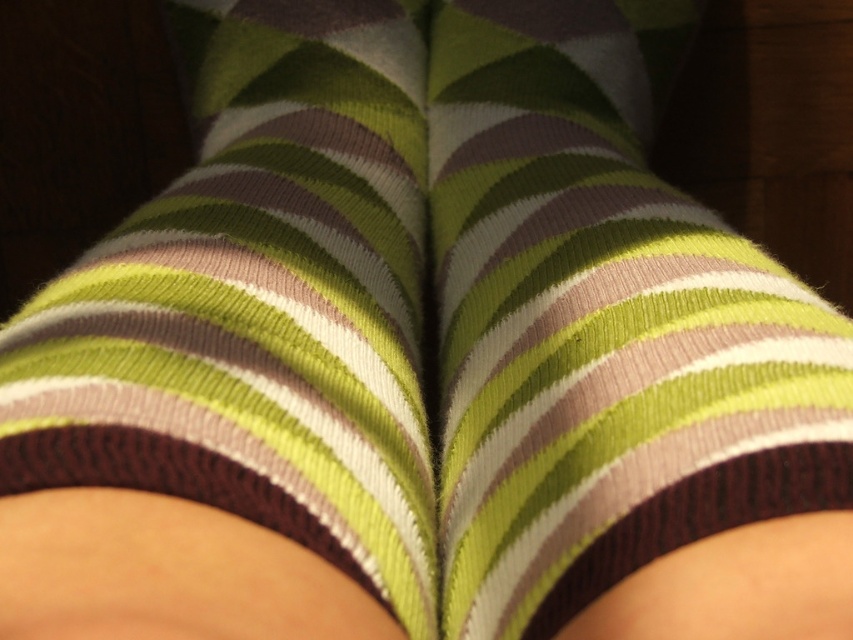
You are a photographer trying to capture the socks in the image. Which sock is positioned lower on the legs, the knit green striped sock at center or the knitted green and brown striped sock at center?

The knit green striped sock at center is positioned below the knitted green and brown striped sock at center, so it is lower on the legs.

You are a photographer trying to capture the exact center of the image. You notice a point at coordinates (599, 324). What object is located at this point?

The point at coordinates (599, 324) is where the knit green striped sock at center is located.